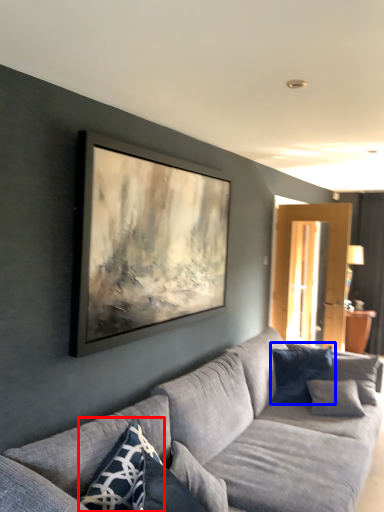
Question: Among these objects, which one is nearest to the camera, pillow (highlighted by a red box) or pillow (highlighted by a blue box)?

Choices:
 (A) pillow
 (B) pillow

Answer: (A)